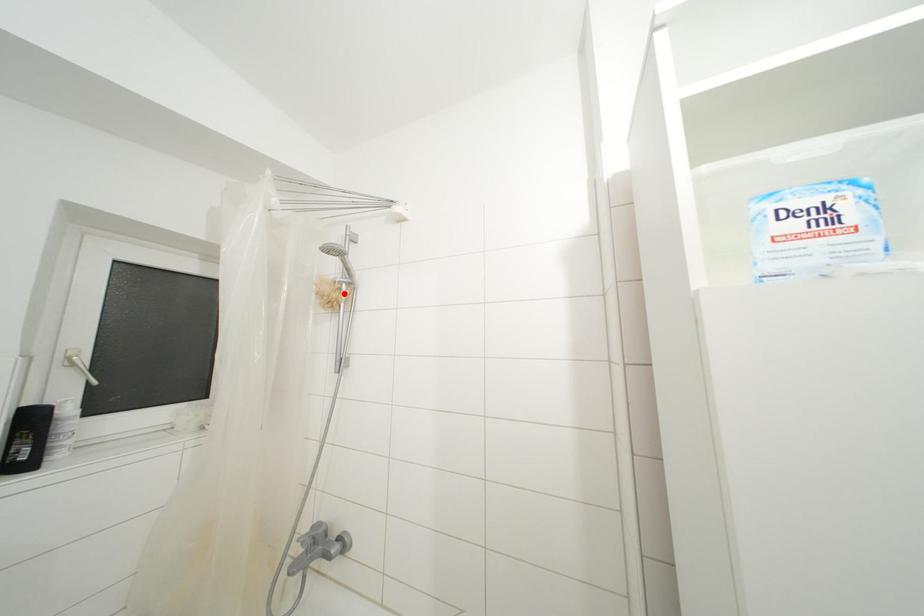
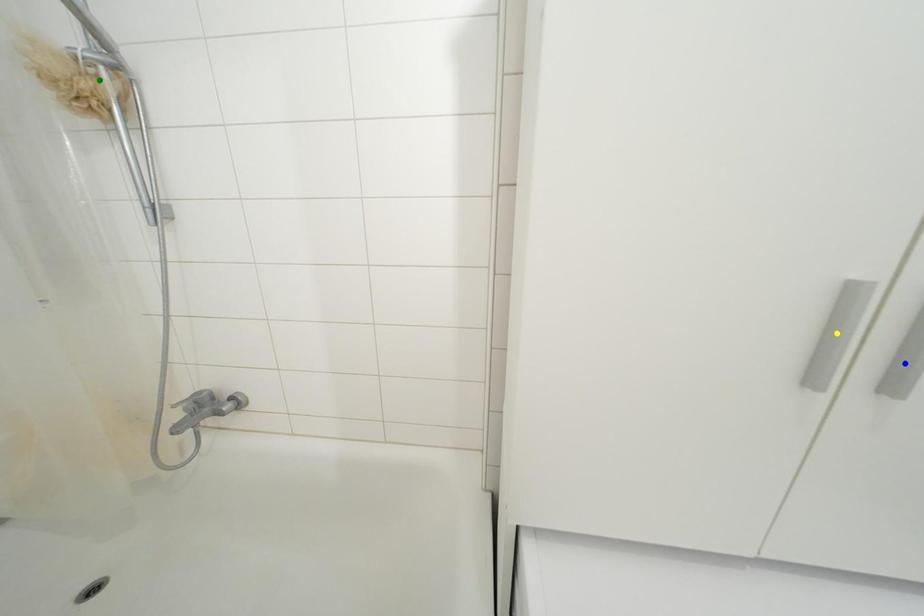
Question: I am providing you with two images of the same scene from different viewpoints. A red point is marked on the first image. You are given multiple points on the second image. Which spot in image 2 lines up with the point in image 1?

Choices:
 (A) green point
 (B) blue point
 (C) yellow point

Answer: (A)